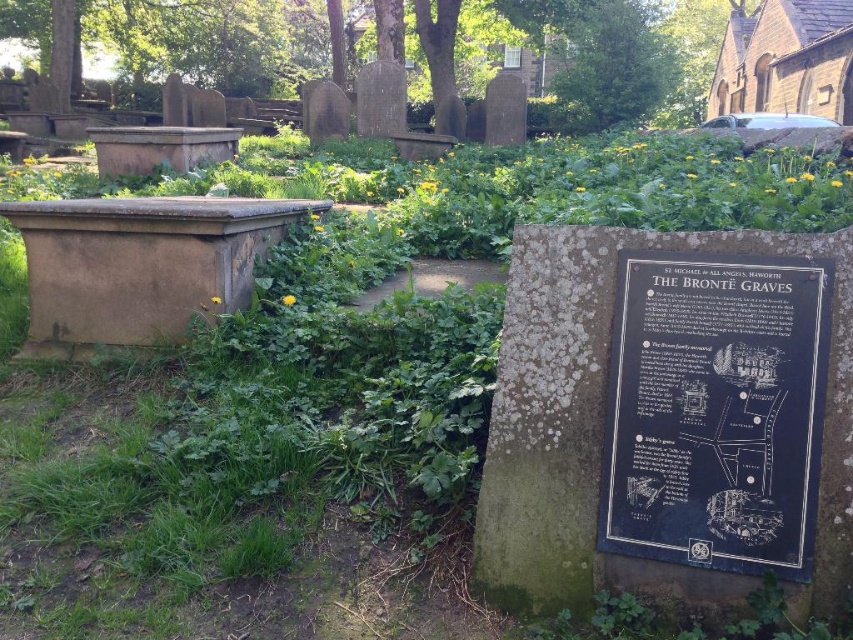
You are standing at the entrance of the cemetery and want to locate the black polished stone plaque at center. According to the coordinates provided, where should you look relative to your position?

The black polished stone plaque at center is located at coordinates point (715, 410), which means it is positioned to the right and slightly forward from your current position at the entrance.

You are standing in front of the Bront? Graves at St. Michael?s Church in Haworth. You notice two items of interest. One is the black polished stone plaque at center and the other is the brown stone sarcophagus at left. Which of these two items is physically nearer to you?

The black polished stone plaque at center is closer to the viewer than the brown stone sarcophagus at left, so the plaque is nearer to you.